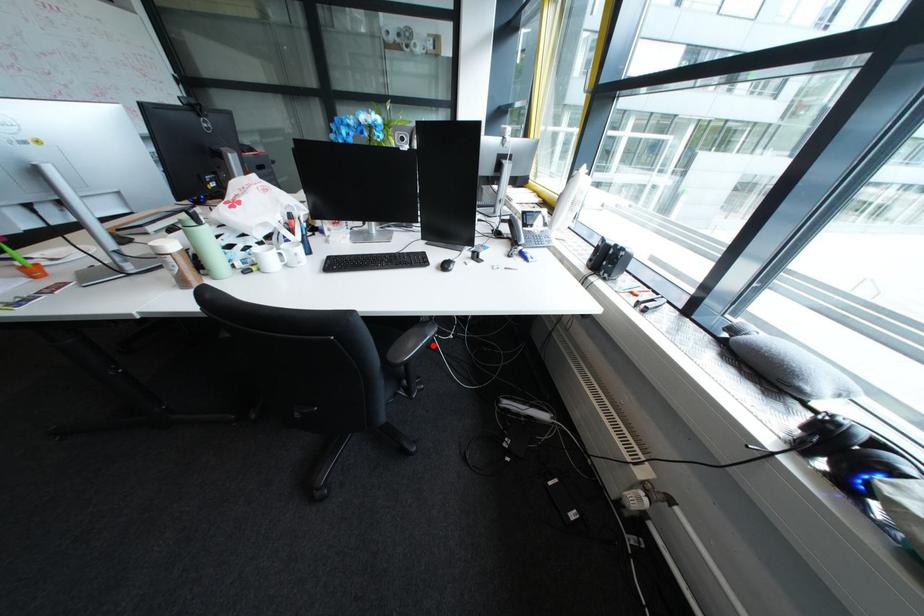
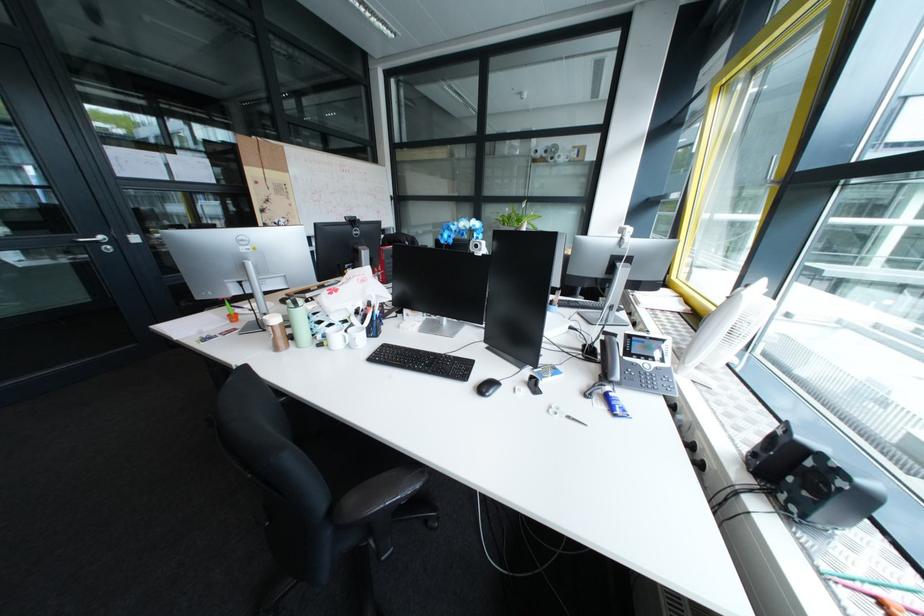
The point at the highlighted location is marked in the first image. Where is the corresponding point in the second image?

(393, 507)